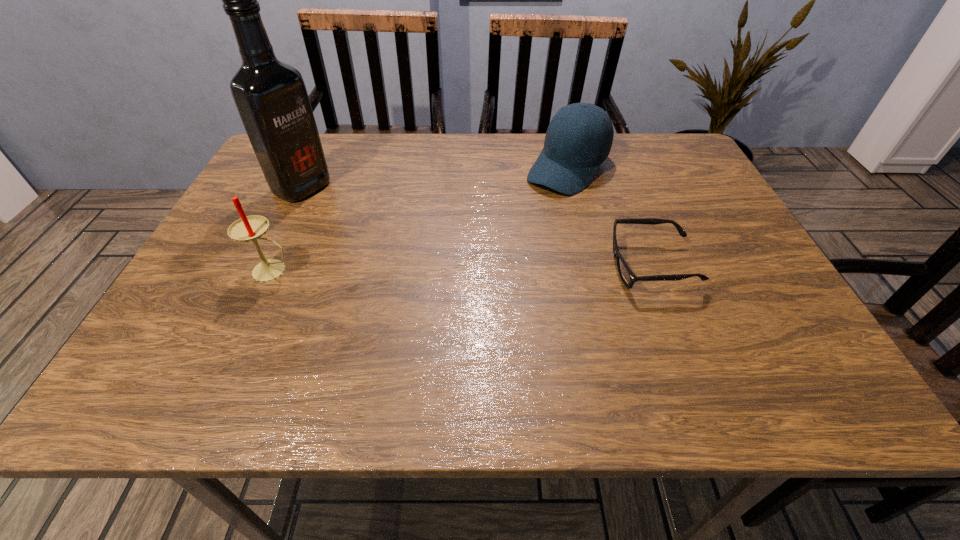
The image size is (960, 540). I want to click on vacant space at the far edge, so click(x=347, y=181).

Image resolution: width=960 pixels, height=540 pixels. I want to click on vacant space at the near edge of the desktop, so click(656, 319).

In the image, there is a desktop. At what (x,y) coordinates should I click in order to perform the action: click on blank space at the left edge. Please return your answer as a coordinate pair (x, y). Image resolution: width=960 pixels, height=540 pixels. Looking at the image, I should click on (278, 234).

Find the location of a particular element. This screenshot has height=540, width=960. vacant point at the right edge is located at coordinates (708, 232).

The image size is (960, 540). I want to click on free location at the far right corner of the desktop, so click(676, 143).

Identify the location of free area in between the baseball cap and the tallest object. (435, 178).

The image size is (960, 540). What are the coordinates of `free space between the second shortest object and the second tallest object` in the screenshot? It's located at (420, 219).

At what (x,y) coordinates should I click in order to perform the action: click on free point between the baseball cap and the sunglasses. Please return your answer as a coordinate pair (x, y). Image resolution: width=960 pixels, height=540 pixels. Looking at the image, I should click on (610, 217).

You are a GUI agent. You are given a task and a screenshot of the screen. Output one action in this format:
    pyautogui.click(x=<x>, y=<y>)
    Task: Click on the unoccupied position between the shortest object and the candle
    The height and width of the screenshot is (540, 960).
    Given the screenshot: What is the action you would take?
    pyautogui.click(x=463, y=268)

This screenshot has width=960, height=540. What are the coordinates of `free space between the tallest object and the baseball cap` in the screenshot? It's located at (435, 178).